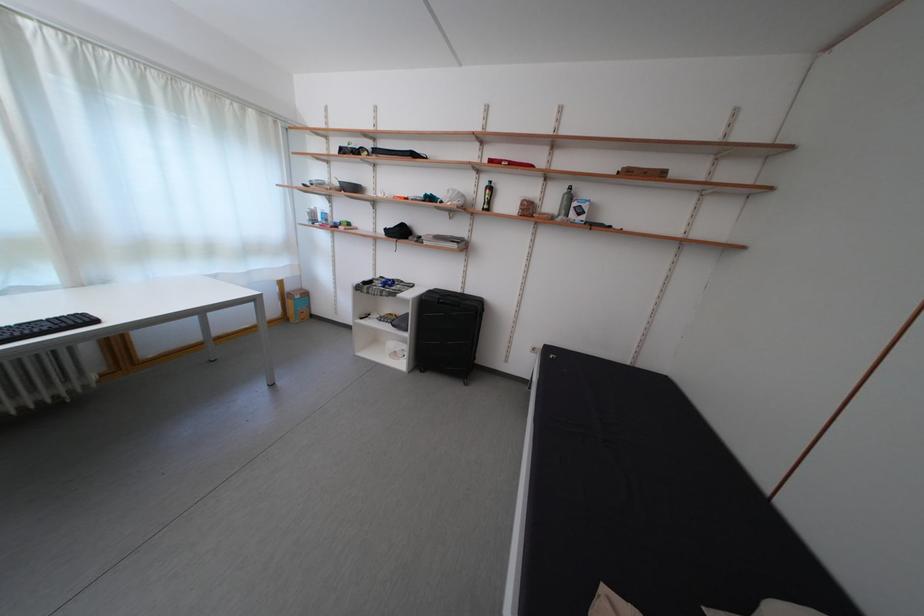
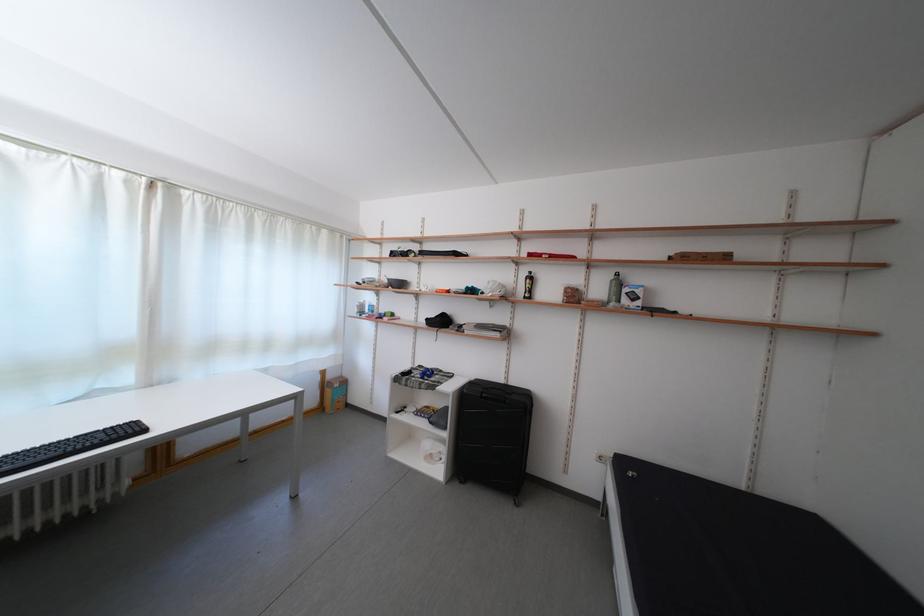
Which direction would the cameraman need to move to produce the second image?

The cameraman walked toward left, forward.